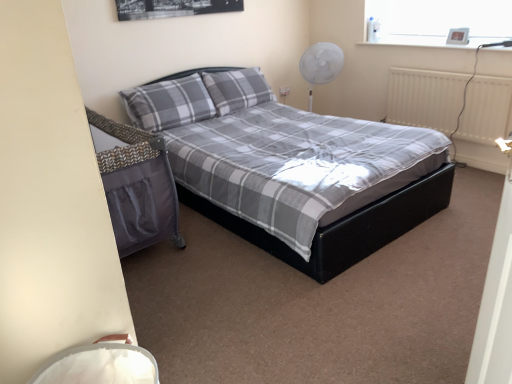
Question: Does matte black bed at center have a lesser height compared to white plastic fan at upper right?

Choices:
 (A) no
 (B) yes

Answer: (A)

Question: Does matte black bed at center have a lesser width compared to white plastic fan at upper right?

Choices:
 (A) yes
 (B) no

Answer: (B)

Question: Is white plastic fan at upper right surrounded by matte black bed at center?

Choices:
 (A) yes
 (B) no

Answer: (B)

Question: Is matte black bed at center taller than white plastic fan at upper right?

Choices:
 (A) no
 (B) yes

Answer: (B)

Question: From the image's perspective, is matte black bed at center located above white plastic fan at upper right?

Choices:
 (A) no
 (B) yes

Answer: (A)

Question: From a real-world perspective, is matte black bed at center physically below white plastic fan at upper right?

Choices:
 (A) yes
 (B) no

Answer: (A)

Question: Considering the relative sizes of gray plaid pillow at center, the second pillow from the left, and metallic digital clock at upper right in the image provided, is gray plaid pillow at center, the second pillow from the left, smaller than metallic digital clock at upper right?

Choices:
 (A) no
 (B) yes

Answer: (A)

Question: Is gray plaid pillow at center, which is the first pillow from right to left, turned away from metallic digital clock at upper right?

Choices:
 (A) no
 (B) yes

Answer: (A)

Question: Is metallic digital clock at upper right inside gray plaid pillow at center, which is the first pillow from right to left?

Choices:
 (A) yes
 (B) no

Answer: (B)

Question: Does gray plaid pillow at center, which is the first pillow from right to left, have a lesser height compared to metallic digital clock at upper right?

Choices:
 (A) no
 (B) yes

Answer: (A)

Question: Is gray plaid pillow at center, the second pillow from the left, positioned in front of metallic digital clock at upper right?

Choices:
 (A) no
 (B) yes

Answer: (A)

Question: Is gray plaid pillow at center, which is the first pillow from right to left, at the left side of metallic digital clock at upper right?

Choices:
 (A) yes
 (B) no

Answer: (A)

Question: Considering the relative sizes of metallic digital clock at upper right and white matte radiator at right in the image provided, is metallic digital clock at upper right bigger than white matte radiator at right?

Choices:
 (A) no
 (B) yes

Answer: (A)